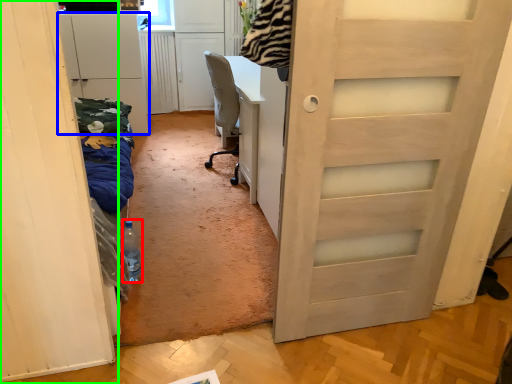
Question: Based on their relative distances, which object is nearer to bottle (highlighted by a red box)? Choose from cabinetry (highlighted by a blue box) and door (highlighted by a green box).

Choices:
 (A) cabinetry
 (B) door

Answer: (B)